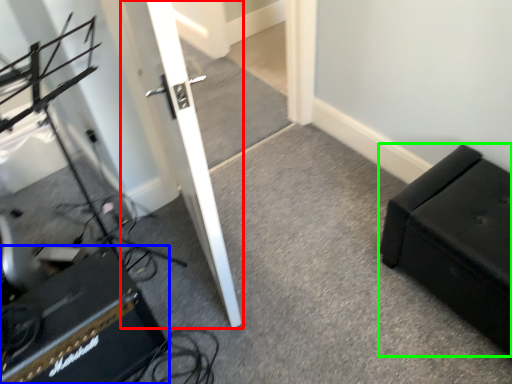
Question: Considering the real-world distances, which object is closest to door (highlighted by a red box)? speaker (highlighted by a blue box) or furniture (highlighted by a green box).

Choices:
 (A) speaker
 (B) furniture

Answer: (A)